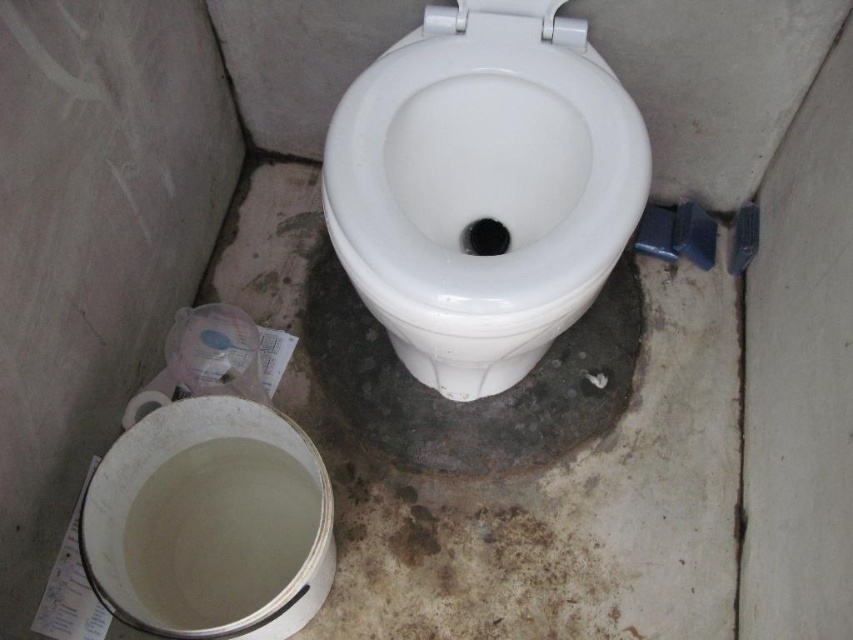
You are a cleaning assistant who needs to clean the bathroom. You see the white glossy toilet bowl at center and the white glossy toilet bowl at lower left. Which one is positioned higher?

The white glossy toilet bowl at center is positioned higher than the white glossy toilet bowl at lower left according to the description.

You are standing in the bathroom and want to reach the point at coordinates (438, 340). If your arm can extend 90 centimeters, will you be able to reach that point without moving?

The distance between you and the point is 93.15 centimeters, which is slightly longer than your arm can reach. You will need to move closer to reach it.